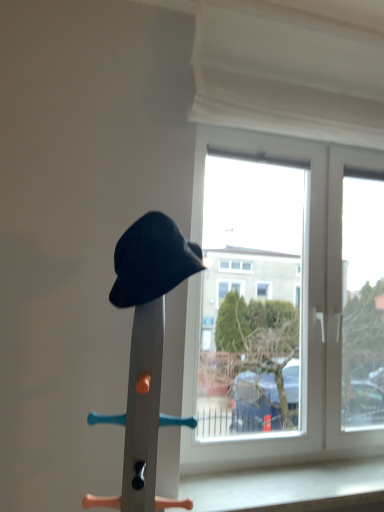
Question: Does transparent glass window at center have a smaller size compared to matte black hat at center?

Choices:
 (A) yes
 (B) no

Answer: (B)

Question: Is transparent glass window at center taller than matte black hat at center?

Choices:
 (A) yes
 (B) no

Answer: (A)

Question: Considering the relative positions of transparent glass window at center and matte black hat at center in the image provided, is transparent glass window at center to the left of matte black hat at center from the viewer's perspective?

Choices:
 (A) yes
 (B) no

Answer: (B)

Question: Can we say transparent glass window at center lies outside matte black hat at center?

Choices:
 (A) no
 (B) yes

Answer: (B)

Question: Can you confirm if transparent glass window at center is wider than matte black hat at center?

Choices:
 (A) yes
 (B) no

Answer: (B)

Question: From the image's perspective, is transparent glass window at center on top of matte black hat at center?

Choices:
 (A) no
 (B) yes

Answer: (B)

Question: Is white fabric curtain at upper center facing towards transparent glass window at center?

Choices:
 (A) yes
 (B) no

Answer: (B)

Question: Is white fabric curtain at upper center at the left side of transparent glass window at center?

Choices:
 (A) yes
 (B) no

Answer: (A)

Question: Is white fabric curtain at upper center closer to the viewer compared to transparent glass window at center?

Choices:
 (A) no
 (B) yes

Answer: (B)

Question: Can you confirm if white fabric curtain at upper center is thinner than transparent glass window at center?

Choices:
 (A) no
 (B) yes

Answer: (A)

Question: Is white fabric curtain at upper center oriented away from transparent glass window at center?

Choices:
 (A) no
 (B) yes

Answer: (A)

Question: Is white fabric curtain at upper center further to camera compared to transparent glass window at center?

Choices:
 (A) yes
 (B) no

Answer: (B)

Question: Considering the relative sizes of matte black hat at center and white fabric curtain at upper center in the image provided, is matte black hat at center bigger than white fabric curtain at upper center?

Choices:
 (A) yes
 (B) no

Answer: (B)